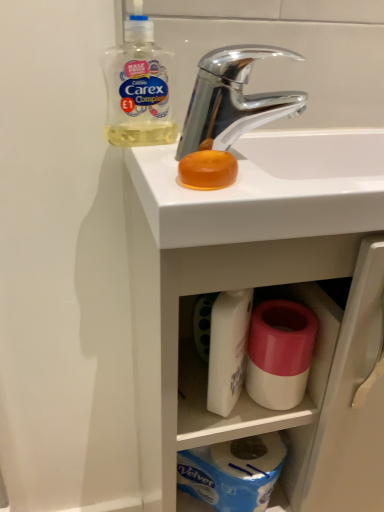
Question: From a real-world perspective, is white glossy sink at upper center located higher than chrome metallic faucet at upper center?

Choices:
 (A) yes
 (B) no

Answer: (B)

Question: Is white glossy sink at upper center not within chrome metallic faucet at upper center?

Choices:
 (A) yes
 (B) no

Answer: (A)

Question: Can you confirm if white glossy sink at upper center is taller than chrome metallic faucet at upper center?

Choices:
 (A) yes
 (B) no

Answer: (A)

Question: Can you confirm if white glossy sink at upper center is shorter than chrome metallic faucet at upper center?

Choices:
 (A) yes
 (B) no

Answer: (B)

Question: Are white glossy sink at upper center and chrome metallic faucet at upper center beside each other?

Choices:
 (A) no
 (B) yes

Answer: (A)

Question: Is white glossy sink at upper center closer to the viewer compared to chrome metallic faucet at upper center?

Choices:
 (A) no
 (B) yes

Answer: (B)

Question: Can you confirm if translucent plastic bottle at upper left is smaller than white glossy sink at upper center?

Choices:
 (A) no
 (B) yes

Answer: (B)

Question: Can you confirm if translucent plastic bottle at upper left is wider than white glossy sink at upper center?

Choices:
 (A) yes
 (B) no

Answer: (B)

Question: Can you confirm if translucent plastic bottle at upper left is positioned to the left of white glossy sink at upper center?

Choices:
 (A) no
 (B) yes

Answer: (B)

Question: From a real-world perspective, does translucent plastic bottle at upper left stand above white glossy sink at upper center?

Choices:
 (A) no
 (B) yes

Answer: (B)

Question: Is translucent plastic bottle at upper left not near white glossy sink at upper center?

Choices:
 (A) no
 (B) yes

Answer: (A)

Question: Can you confirm if translucent plastic bottle at upper left is thinner than white glossy sink at upper center?

Choices:
 (A) yes
 (B) no

Answer: (A)

Question: Is pink matte toilet paper at lower center aimed at chrome metallic faucet at upper center?

Choices:
 (A) no
 (B) yes

Answer: (A)